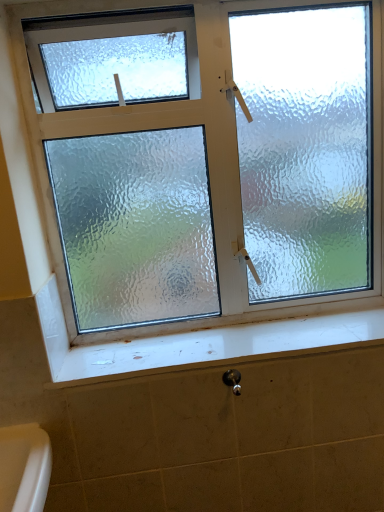
Question: In the image, is white glossy window sill at lower center on the left side or the right side of satin nickel shower at lower center?

Choices:
 (A) right
 (B) left

Answer: (A)

Question: From the image's perspective, is white glossy window sill at lower center located above or below satin nickel shower at lower center?

Choices:
 (A) below
 (B) above

Answer: (B)

Question: Considering their positions, is white glossy window sill at lower center located in front of or behind satin nickel shower at lower center?

Choices:
 (A) behind
 (B) front

Answer: (A)

Question: In terms of width, does satin nickel shower at lower center look wider or thinner when compared to white glossy window sill at lower center?

Choices:
 (A) thin
 (B) wide

Answer: (A)

Question: Do you think satin nickel shower at lower center is within white glossy window sill at lower center, or outside of it?

Choices:
 (A) inside
 (B) outside

Answer: (B)

Question: Looking at the image, does satin nickel shower at lower center seem bigger or smaller compared to white glossy window sill at lower center?

Choices:
 (A) big
 (B) small

Answer: (B)

Question: Would you say satin nickel shower at lower center is to the left or to the right of white glossy window sill at lower center in the picture?

Choices:
 (A) right
 (B) left

Answer: (B)